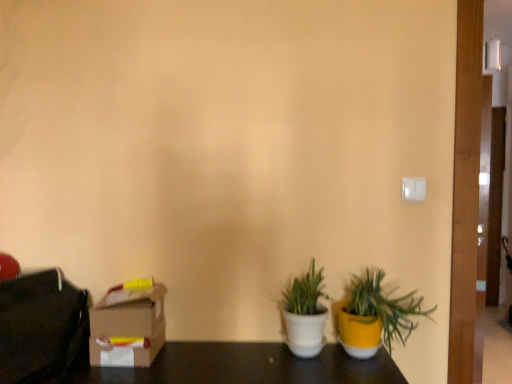
Question: From the image's perspective, is white matte pot at center, the second houseplant viewed from the right, above yellow matte pot at lower right, which is the 1th houseplant in right-to-left order?

Choices:
 (A) yes
 (B) no

Answer: (B)

Question: Considering the relative sizes of white matte pot at center, which ranks as the first houseplant in left-to-right order, and yellow matte pot at lower right, the second houseplant in the left-to-right sequence, in the image provided, is white matte pot at center, which ranks as the first houseplant in left-to-right order, smaller than yellow matte pot at lower right, the second houseplant in the left-to-right sequence,?

Choices:
 (A) no
 (B) yes

Answer: (B)

Question: Can you confirm if white matte pot at center, the second houseplant viewed from the right, is taller than yellow matte pot at lower right, which is the 1th houseplant in right-to-left order?

Choices:
 (A) no
 (B) yes

Answer: (B)

Question: From a real-world perspective, is white matte pot at center, the second houseplant viewed from the right, under yellow matte pot at lower right, which is the 1th houseplant in right-to-left order?

Choices:
 (A) yes
 (B) no

Answer: (A)

Question: From the image's perspective, is white matte pot at center, which ranks as the first houseplant in left-to-right order, below yellow matte pot at lower right, which is the 1th houseplant in right-to-left order?

Choices:
 (A) no
 (B) yes

Answer: (B)

Question: From the image's perspective, is white matte pot at center, the second houseplant viewed from the right, above or below cardboard box at lower left?

Choices:
 (A) below
 (B) above

Answer: (B)

Question: From a real-world perspective, is white matte pot at center, the second houseplant viewed from the right, physically located above or below cardboard box at lower left?

Choices:
 (A) above
 (B) below

Answer: (A)

Question: Is white matte pot at center, the second houseplant viewed from the right, taller or shorter than cardboard box at lower left?

Choices:
 (A) tall
 (B) short

Answer: (A)

Question: Considering the positions of white matte pot at center, which ranks as the first houseplant in left-to-right order, and cardboard box at lower left in the image, is white matte pot at center, which ranks as the first houseplant in left-to-right order, wider or thinner than cardboard box at lower left?

Choices:
 (A) wide
 (B) thin

Answer: (A)

Question: Considering their positions, is matte black bag at left located in front of or behind white matte pot at center, the second houseplant viewed from the right?

Choices:
 (A) front
 (B) behind

Answer: (A)

Question: From a real-world perspective, is matte black bag at left physically located above or below white matte pot at center, the second houseplant viewed from the right?

Choices:
 (A) above
 (B) below

Answer: (A)

Question: Considering the positions of matte black bag at left and white matte pot at center, the second houseplant viewed from the right, in the image, is matte black bag at left wider or thinner than white matte pot at center, the second houseplant viewed from the right,?

Choices:
 (A) thin
 (B) wide

Answer: (B)

Question: Is matte black bag at left spatially inside white matte pot at center, the second houseplant viewed from the right, or outside of it?

Choices:
 (A) outside
 (B) inside

Answer: (A)

Question: From the image's perspective, is yellow matte pot at lower right, which is the 1th houseplant in right-to-left order, positioned above or below cardboard box at lower left?

Choices:
 (A) below
 (B) above

Answer: (B)

Question: Considering the relative positions of yellow matte pot at lower right, which is the 1th houseplant in right-to-left order, and cardboard box at lower left in the image provided, is yellow matte pot at lower right, which is the 1th houseplant in right-to-left order, to the left or to the right of cardboard box at lower left?

Choices:
 (A) right
 (B) left

Answer: (A)